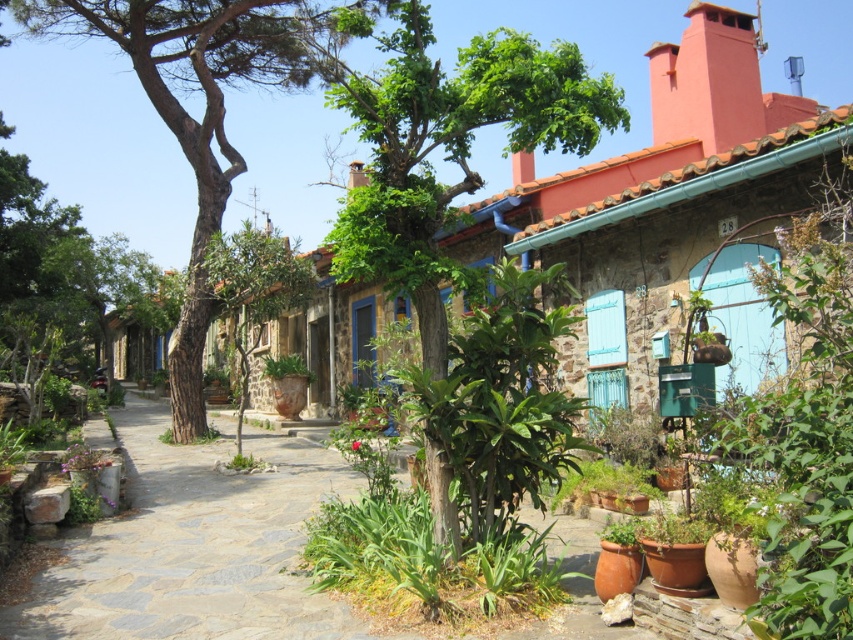
You are standing at the start of a gray stone path at center in a picturesque village. You want to walk to a nearby flower shop located 5 meters away from your current position. Can you reach it without walking more than 5 meters?

The gray stone path at center is 5.15 meters away from the camera, so walking to it would exceed the 5 meters limit. Therefore, you cannot reach the flower shop within the desired distance.

You are a tourist walking along the gray stone path at center in a European village. You look up and see the brown rough bark tree at center. Where is the tree located relative to the path?

The brown rough bark tree at center is above the gray stone path at center.

You are a tourist standing on the rustic street and want to take a photo of both the green leafy tree at center and the smooth terracotta chimney at upper right. Which object should you focus on first to ensure both are in the frame?

You should focus on the green leafy tree at center first because it is closer to the viewer than the smooth terracotta chimney at upper right, allowing both to be in the frame.